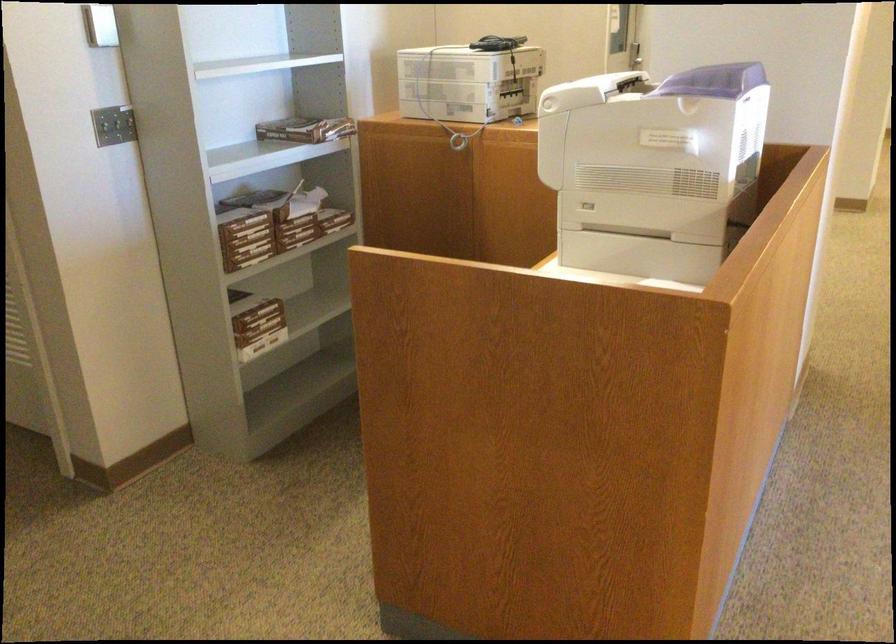
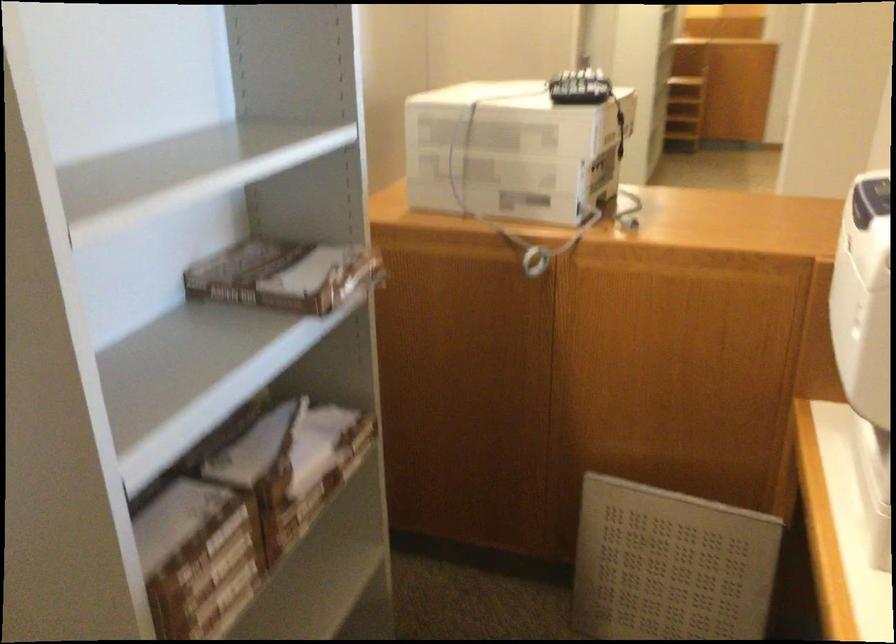
Which direction would the cameraman need to move to produce the second image?

The cameraman moved toward left, forward.